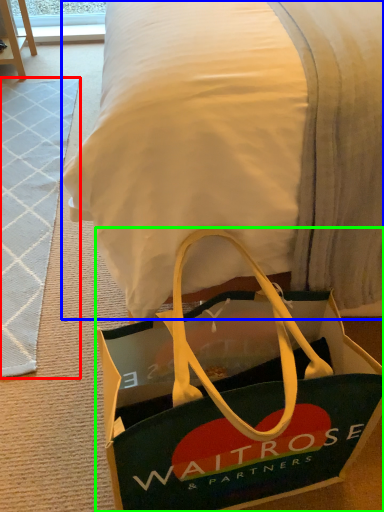
Question: Which object is positioned farthest from doormat (highlighted by a red box)? Select from blanket (highlighted by a blue box) and handbag (highlighted by a green box).

Choices:
 (A) blanket
 (B) handbag

Answer: (A)